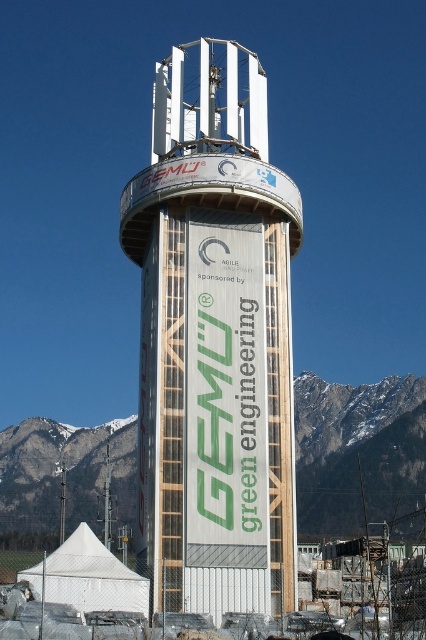
In the scene shown: You are a photographer planning to capture the wooden tower at center and the snowy rocky mountain at center in a single frame. Based on their widths, which object should you position closer to the center of your camera frame to ensure both are fully visible?

The wooden tower at center has a lesser width compared to the snowy rocky mountain at center. To ensure both are fully visible in the frame, position the wider snowy rocky mountain at center closer to the center of your camera frame, as it requires more space, while the narrower wooden tower at center can be placed slightly off to one side.

You are a drone operator planning to fly a drone from the wooden tower at center to the snowy rocky mountain at center. According to the image, which direction should you fly the drone to reach the mountain?

The wooden tower at center is located above the snowy rocky mountain at center, so you should fly the drone downward to reach the mountain.